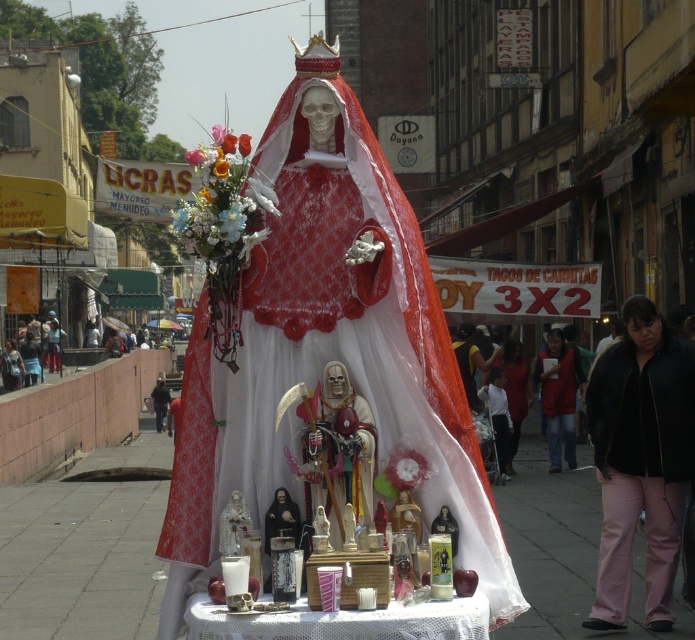
Does pink fabric pants at lower right lie behind red fabric vest at center?

No, it is in front of red fabric vest at center.

What are the coordinates of `pink fabric pants at lower right` in the screenshot? It's located at (639, 460).

Is point (629, 346) in front of point (550, 360)?

Yes.

What are the coordinates of `pink fabric pants at lower right` in the screenshot? It's located at (639, 460).

Does matte red fabric altar at center have a greater width compared to red fabric vest at center?

No.

Does matte red fabric altar at center appear on the right side of red fabric vest at center?

In fact, matte red fabric altar at center is to the left of red fabric vest at center.

This screenshot has width=695, height=640. What do you see at coordinates (327, 348) in the screenshot?
I see `matte red fabric altar at center` at bounding box center [327, 348].

This screenshot has height=640, width=695. I want to click on matte red fabric altar at center, so click(x=327, y=348).

Is matte red fabric altar at center shorter than pink fabric pants at lower right?

Correct, matte red fabric altar at center is not as tall as pink fabric pants at lower right.

Does matte red fabric altar at center have a lesser width compared to pink fabric pants at lower right?

Indeed, matte red fabric altar at center has a lesser width compared to pink fabric pants at lower right.

Who is more distant from viewer, (332, 461) or (648, 456)?

Point (648, 456)

What are the coordinates of `matte red fabric altar at center` in the screenshot? It's located at (327, 348).